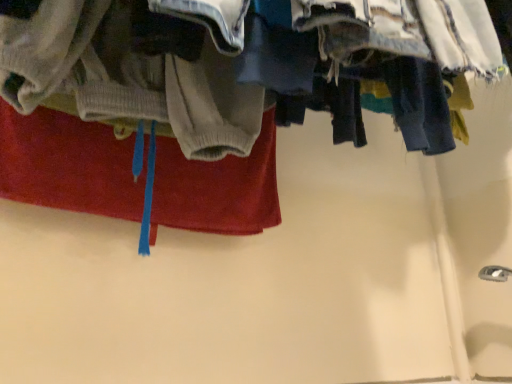
Question: From the image's perspective, is denim fabric pants at upper right positioned above or below red cotton towel at upper left?

Choices:
 (A) below
 (B) above

Answer: (B)

Question: From their relative heights in the image, would you say denim fabric pants at upper right is taller or shorter than red cotton towel at upper left?

Choices:
 (A) tall
 (B) short

Answer: (A)

Question: Is denim fabric pants at upper right to the left or to the right of red cotton towel at upper left in the image?

Choices:
 (A) left
 (B) right

Answer: (B)

Question: Is point (159, 211) positioned closer to the camera than point (4, 21)?

Choices:
 (A) farther
 (B) closer

Answer: (A)

Question: Considering the positions of red cotton towel at upper left and denim fabric pants at upper right in the image, is red cotton towel at upper left taller or shorter than denim fabric pants at upper right?

Choices:
 (A) tall
 (B) short

Answer: (B)

Question: From a real-world perspective, relative to denim fabric pants at upper right, is red cotton towel at upper left vertically above or below?

Choices:
 (A) above
 (B) below

Answer: (B)

Question: Choose the correct answer: Is red cotton towel at upper left inside denim fabric pants at upper right or outside it?

Choices:
 (A) outside
 (B) inside

Answer: (A)